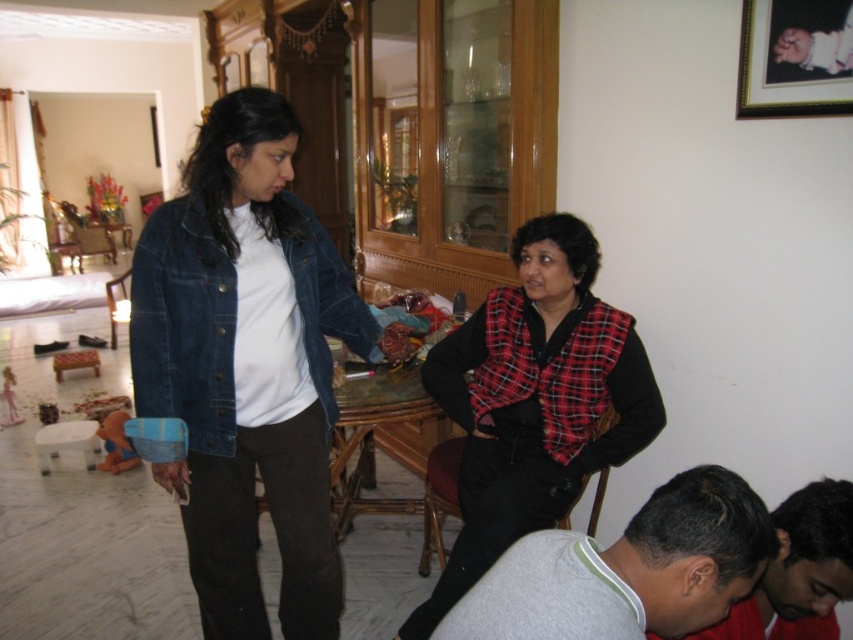
You are a delivery person who needs to place a package between the denim jacket at center and the gray fleece shirt at lower right. The package is 36 inches long. Can you fit it between them without moving either item?

The denim jacket at center and gray fleece shirt at lower right are 38.31 inches apart from each other. Since the package is 36 inches long, it can fit between them as there is enough space.

You are a person who is 1.6 meters tall standing in the living room. You want to reach the wooden picture frame at upper right. Can you touch it without any assistance?

The wooden picture frame at upper right is 1.64 meters away from the viewer. Since you are 1.6 meters tall, you cannot reach it without assistance because the distance is slightly greater than your height.

You are standing at point (758, 0) and want to walk to point (38, 438). Which direction should you move?

You should move backward because point (758, 0) is in front of point (38, 438).